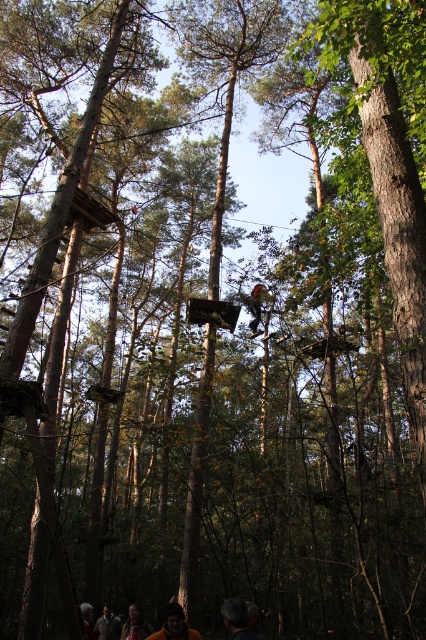
Who is more forward, (157, 632) or (97, 625)?

Point (97, 625) is in front.

Who is positioned more to the right, brown leather jacket at lower center or orange fabric jacket at lower center?

brown leather jacket at lower center is more to the right.

Based on the photo, who is more distant from viewer, (x=170, y=604) or (x=120, y=628)?

Positioned behind is point (x=120, y=628).

Identify the location of brown leather jacket at lower center. (175, 625).

Can you confirm if dark brown hair at lower center is bigger than brown leather jacket at lower center?

Incorrect, dark brown hair at lower center is not larger than brown leather jacket at lower center.

Does dark brown hair at lower center have a lesser height compared to brown leather jacket at lower center?

Indeed, dark brown hair at lower center has a lesser height compared to brown leather jacket at lower center.

Is point (236, 609) positioned behind point (173, 636)?

No.

The image size is (426, 640). Identify the location of dark brown hair at lower center. (236, 620).

Between dark brown hair at lower center and orange fabric jacket at lower center, which one is positioned lower?

Positioned lower is orange fabric jacket at lower center.

Can you confirm if dark brown hair at lower center is positioned above orange fabric jacket at lower center?

Indeed, dark brown hair at lower center is positioned over orange fabric jacket at lower center.

Image resolution: width=426 pixels, height=640 pixels. What do you see at coordinates (236, 620) in the screenshot?
I see `dark brown hair at lower center` at bounding box center [236, 620].

Locate an element on the screen. The height and width of the screenshot is (640, 426). dark brown hair at lower center is located at coordinates (236, 620).